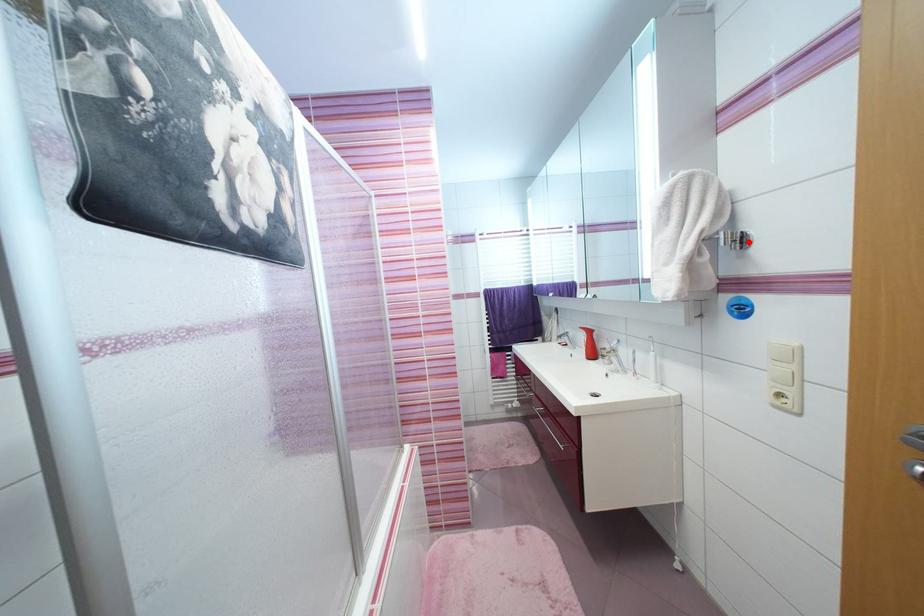
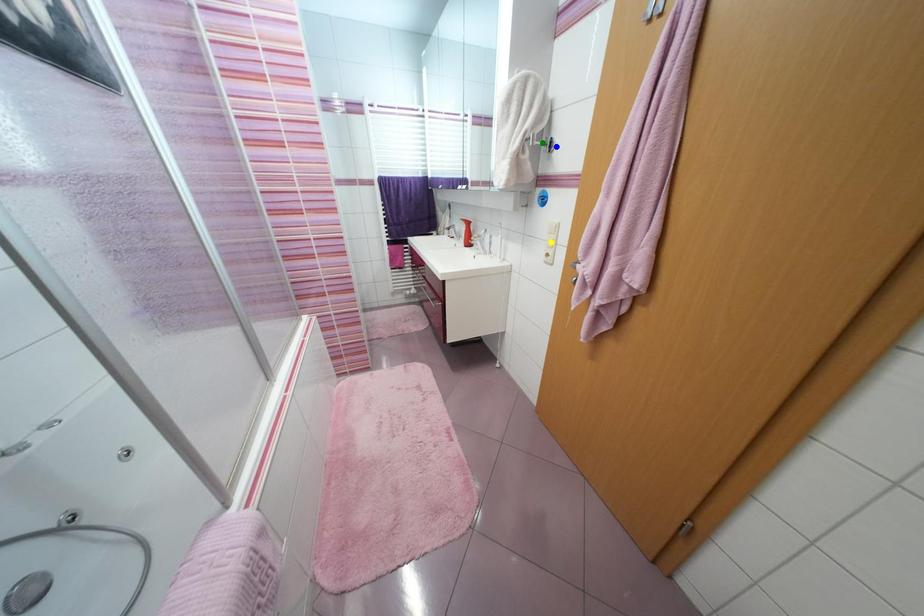
Question: I am providing you with two images of the same scene from different viewpoints. A red point is marked on the first image. You are given multiple points on the second image. Which point in image 2 represents the same 3d spot as the red point in image 1?

Choices:
 (A) blue point
 (B) yellow point
 (C) green point

Answer: (A)